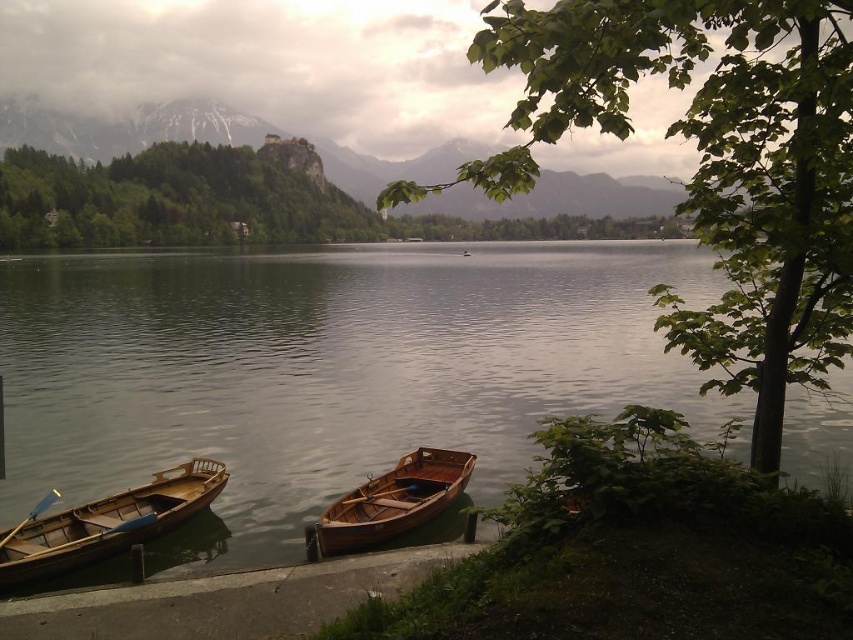
Between smooth water at center and wooden dock at lower left, which one appears on the right side from the viewer's perspective?

Positioned to the right is wooden dock at lower left.

Image resolution: width=853 pixels, height=640 pixels. What do you see at coordinates (323, 371) in the screenshot? I see `smooth water at center` at bounding box center [323, 371].

Does point (218, 333) lie behind point (172, 625)?

Yes, it is behind point (172, 625).

Where is `smooth water at center`? The height and width of the screenshot is (640, 853). smooth water at center is located at coordinates (323, 371).

Who is more distant from viewer, (262, 545) or (15, 570)?

The point (262, 545) is more distant.

Between point (274, 554) and point (169, 477), which one is positioned in front?

Positioned in front is point (274, 554).

This screenshot has width=853, height=640. What are the coordinates of `smooth water at center` in the screenshot? It's located at (323, 371).

Does point (788, 364) lie in front of point (53, 520)?

Yes, point (788, 364) is in front of point (53, 520).

Is green leafy tree at lower right below wooden canoe at lower left?

Actually, green leafy tree at lower right is above wooden canoe at lower left.

What do you see at coordinates (709, 166) in the screenshot? I see `green leafy tree at lower right` at bounding box center [709, 166].

Where is `green leafy tree at lower right`? The width and height of the screenshot is (853, 640). green leafy tree at lower right is located at coordinates (709, 166).